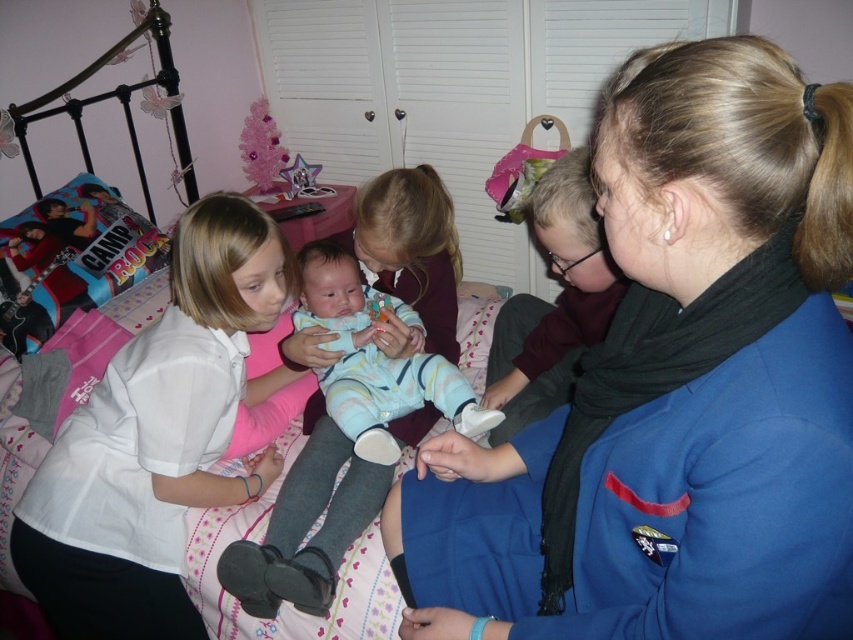
Question: Which object is positioned closest to the white matte shirt at center?

Choices:
 (A) blue uniform at center
 (B) light blue striped onesie at center
 (C) light blue fabric baby at center

Answer: (C)

Question: Is blue uniform at center further to camera compared to light blue fabric baby at center?

Choices:
 (A) yes
 (B) no

Answer: (B)

Question: Does blue uniform at center come in front of light blue striped onesie at center?

Choices:
 (A) yes
 (B) no

Answer: (A)

Question: Which object is positioned closest to the blue uniform at center?

Choices:
 (A) white matte shirt at center
 (B) light blue fabric baby at center

Answer: (B)

Question: Which point is farther to the camera?

Choices:
 (A) (843, 525)
 (B) (410, 326)
 (C) (103, 577)
 (D) (260, 588)

Answer: (B)

Question: Can you confirm if blue uniform at center is positioned below white matte shirt at center?

Choices:
 (A) no
 (B) yes

Answer: (A)